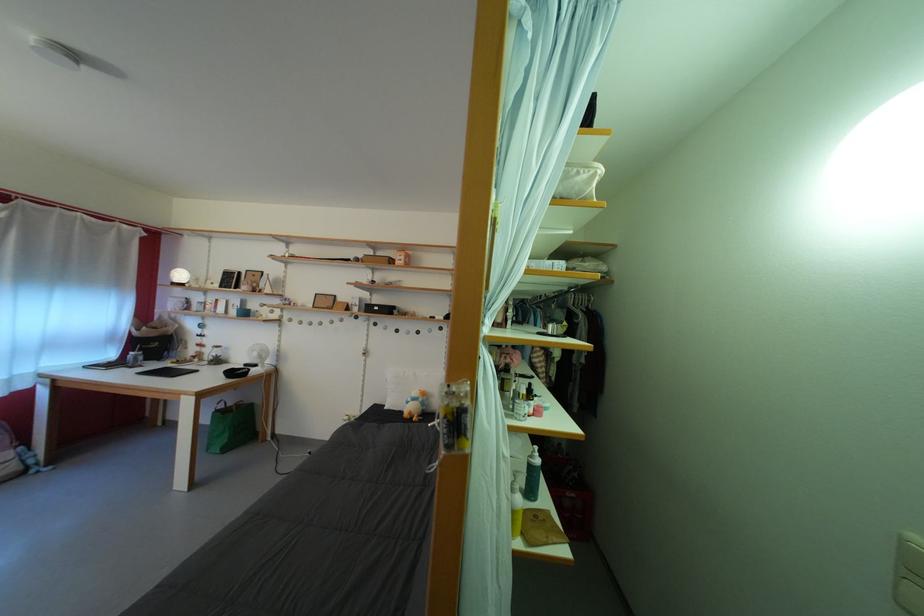
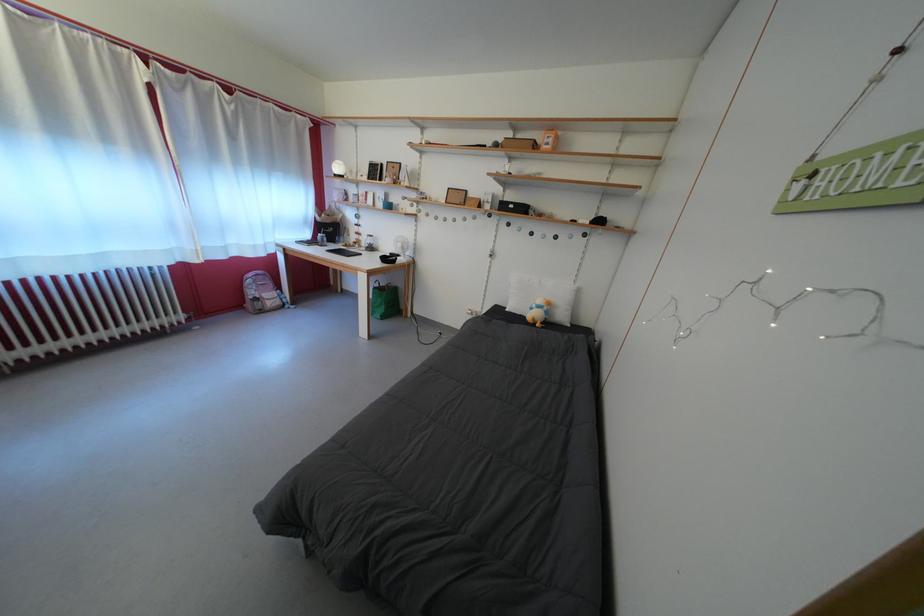
In the second image, find the point that corresponds to [431,410] in the first image.

(554, 318)